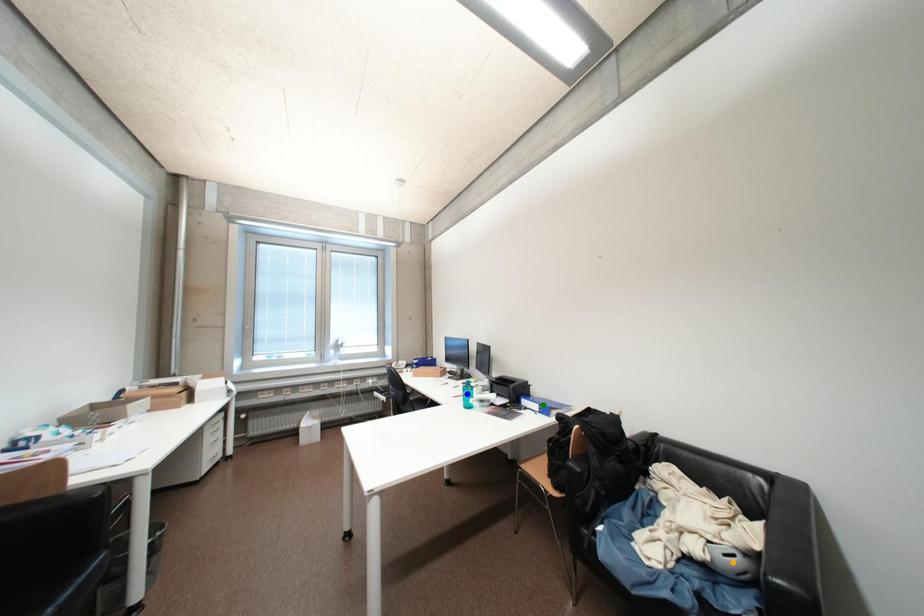
Order these from nearest to farthest:
A) orange point
B) green point
C) blue point

blue point
green point
orange point